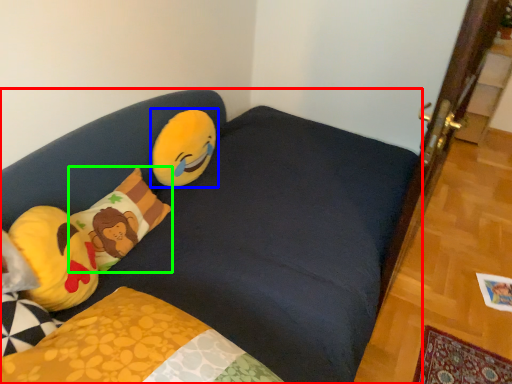
Question: Which object is the farthest from studio couch (highlighted by a red box)? Choose among these: toy (highlighted by a blue box) or pillow (highlighted by a green box).

Choices:
 (A) toy
 (B) pillow

Answer: (A)